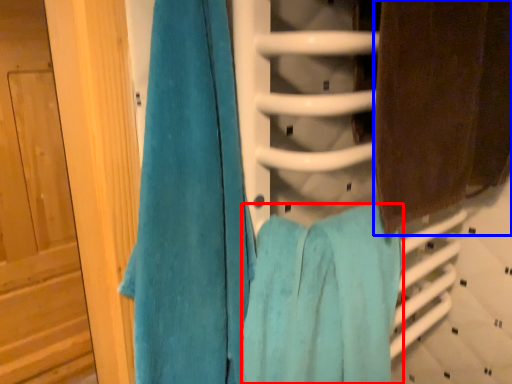
Question: Which point is closer to the camera, towel (highlighted by a red box) or towel (highlighted by a blue box)?

Choices:
 (A) towel
 (B) towel

Answer: (A)